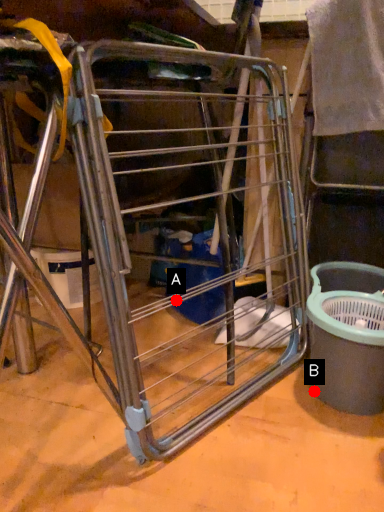
Question: Two points are circled on the image, labeled by A and B beside each circle. Which of the following is the farthest from the observer?

Choices:
 (A) A is further
 (B) B is further

Answer: (B)